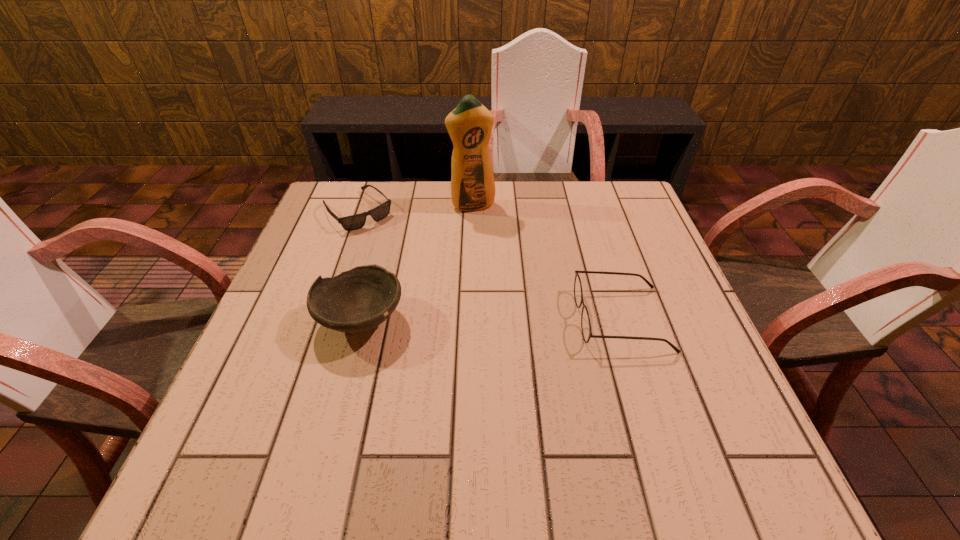
The height and width of the screenshot is (540, 960). I want to click on free space on the desktop that is between the third shortest object and the spectacles and is positioned on the label of the detergent, so click(x=524, y=319).

The width and height of the screenshot is (960, 540). Find the location of `free spot on the desktop that is between the second tallest object and the spectacles and is positioned on the front-facing side of the shortest object`. free spot on the desktop that is between the second tallest object and the spectacles and is positioned on the front-facing side of the shortest object is located at coordinates (460, 319).